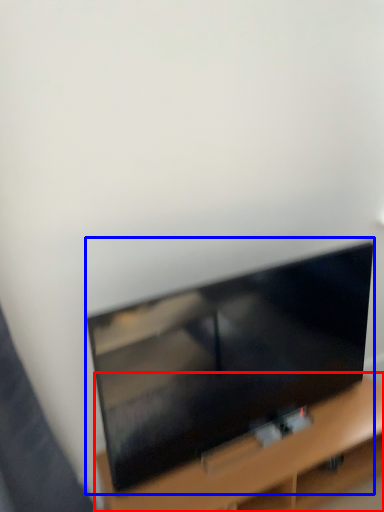
Question: Which point is closer to the camera, furniture (highlighted by a red box) or television (highlighted by a blue box)?

Choices:
 (A) furniture
 (B) television

Answer: (B)